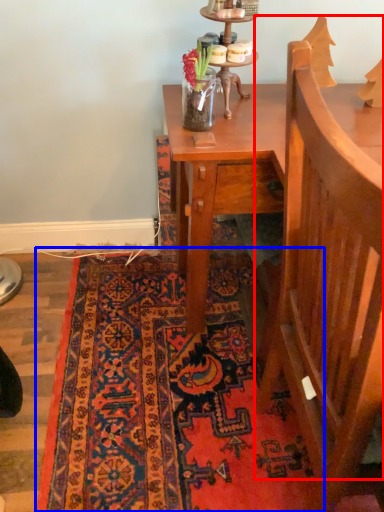
Question: Which object appears closest to the camera in this image, armchair (highlighted by a red box) or mat (highlighted by a blue box)?

Choices:
 (A) armchair
 (B) mat

Answer: (A)